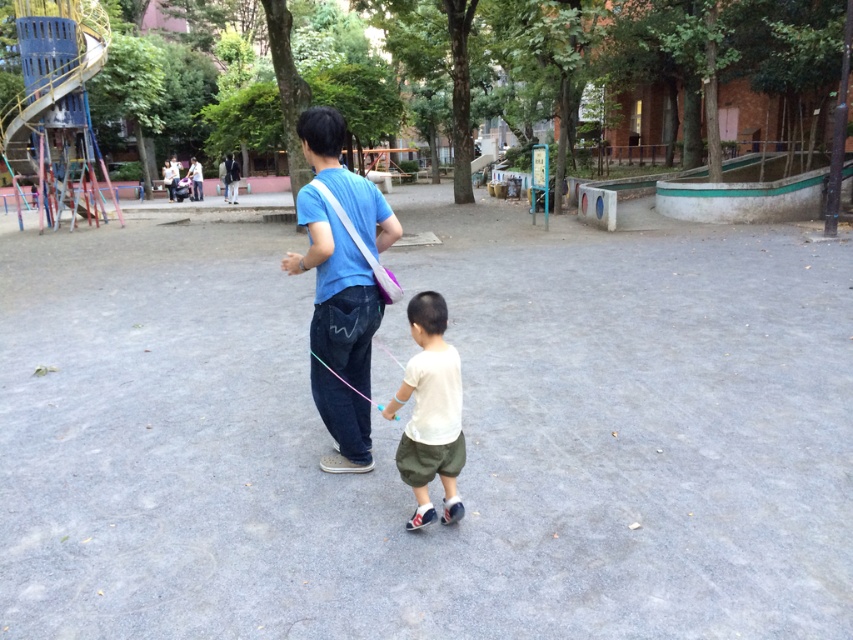
Question: Is blue cotton t-shirt at center below light beige cotton shorts at center?

Choices:
 (A) yes
 (B) no

Answer: (B)

Question: Which of the following is the closest to the observer?

Choices:
 (A) light beige cotton shorts at center
 (B) blue cotton t-shirt at center

Answer: (A)

Question: Does blue cotton t-shirt at center appear under light beige cotton shorts at center?

Choices:
 (A) yes
 (B) no

Answer: (B)

Question: Which point appears farthest from the camera in this image?

Choices:
 (A) (316, 326)
 (B) (451, 445)

Answer: (A)

Question: Where is blue cotton t-shirt at center located in relation to light beige cotton shorts at center in the image?

Choices:
 (A) above
 (B) below

Answer: (A)